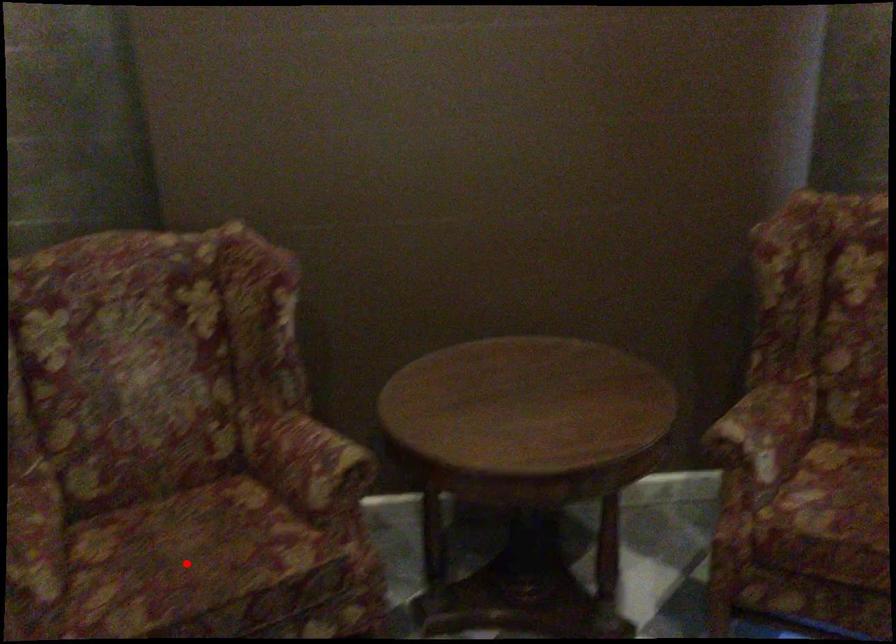
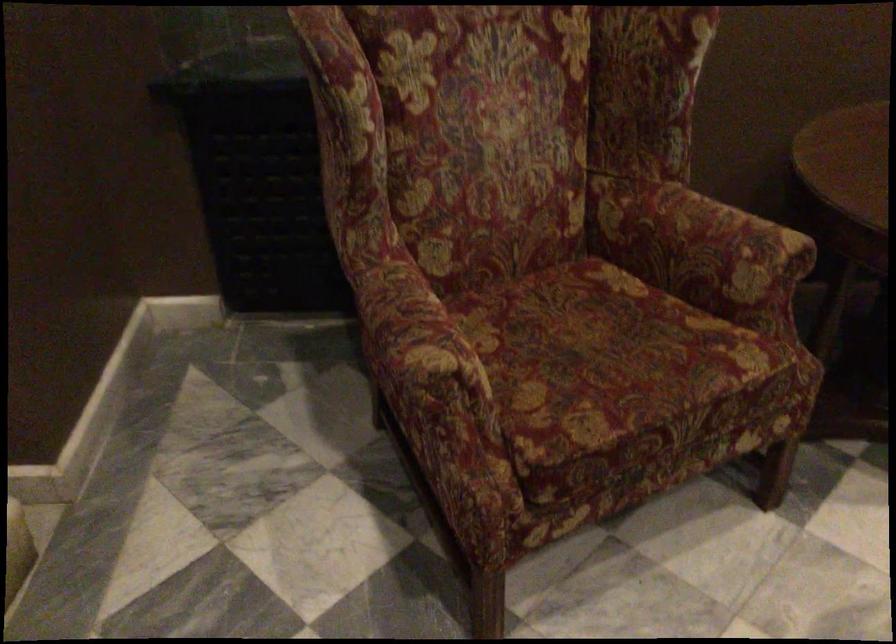
Question: I am providing you with two images of the same scene from different viewpoints. In image1, a red point is highlighted. Considering the same 3D point in image2, which of the following is correct?

Choices:
 (A) It is closer
 (B) It is farther

Answer: (A)